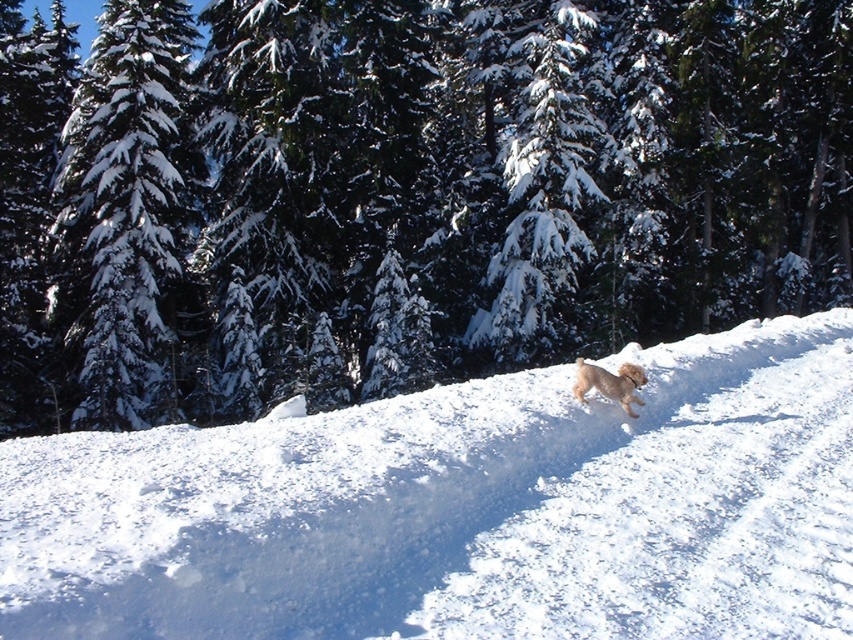
Question: Does green snow-covered tree at upper left appear on the left side of fuzzy golden dog at center?

Choices:
 (A) no
 (B) yes

Answer: (B)

Question: Which of the following is the closest to the observer?

Choices:
 (A) (467, 184)
 (B) (138, 106)
 (C) (741, 499)

Answer: (C)

Question: Which point appears closest to the camera in this image?

Choices:
 (A) (399, 440)
 (B) (585, 381)
 (C) (170, 259)
 (D) (123, 304)

Answer: (A)

Question: Is green matte tree at upper center smaller than green snow-covered tree at upper left?

Choices:
 (A) yes
 (B) no

Answer: (B)

Question: Is green matte tree at upper center smaller than green snow-covered tree at upper left?

Choices:
 (A) no
 (B) yes

Answer: (A)

Question: Which of the following is the closest to the observer?

Choices:
 (A) (85, 481)
 (B) (131, 244)
 (C) (403, 244)

Answer: (A)